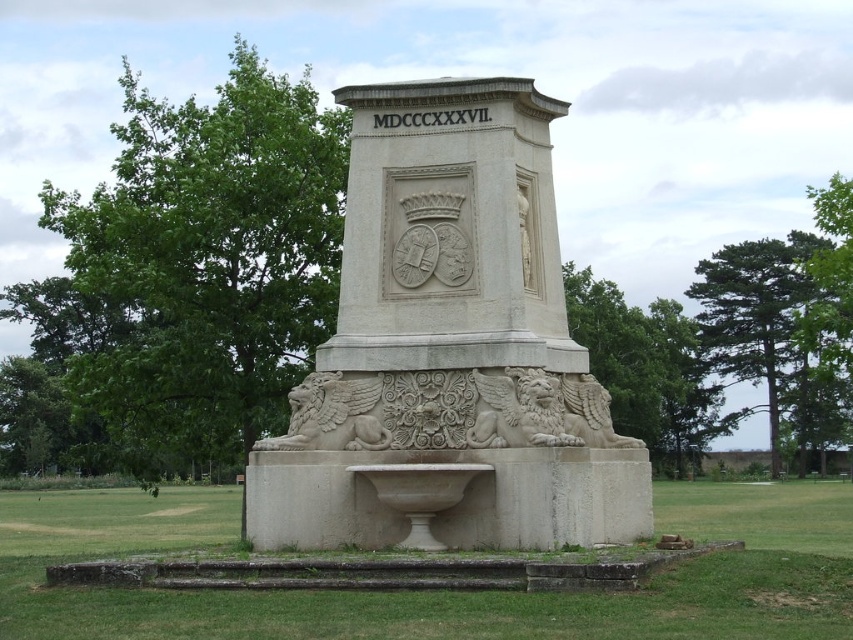
Can you confirm if white stone monument at center is positioned to the left of white stone fountain at center?

Indeed, white stone monument at center is positioned on the left side of white stone fountain at center.

Does white stone monument at center have a greater width compared to white stone fountain at center?

No, white stone monument at center is not wider than white stone fountain at center.

At what (x,y) coordinates should I click in order to perform the action: click on white stone monument at center. Please return your answer as a coordinate pair (x, y). Looking at the image, I should click on (450, 349).

From the picture: Is white stone fountain at center thinner than white stone basin at center?

No, white stone fountain at center is not thinner than white stone basin at center.

Who is positioned more to the right, white stone fountain at center or white stone basin at center?

From the viewer's perspective, white stone fountain at center appears more on the right side.

Is point (833, 588) positioned before point (550, 544)?

Yes, point (833, 588) is closer to viewer.

The width and height of the screenshot is (853, 640). What are the coordinates of `white stone fountain at center` in the screenshot? It's located at (440, 592).

I want to click on white stone monument at center, so click(450, 349).

Can you confirm if white stone monument at center is taller than white stone basin at center?

Correct, white stone monument at center is much taller as white stone basin at center.

Identify the location of white stone monument at center. (450, 349).

This screenshot has width=853, height=640. I want to click on white stone monument at center, so tap(450, 349).